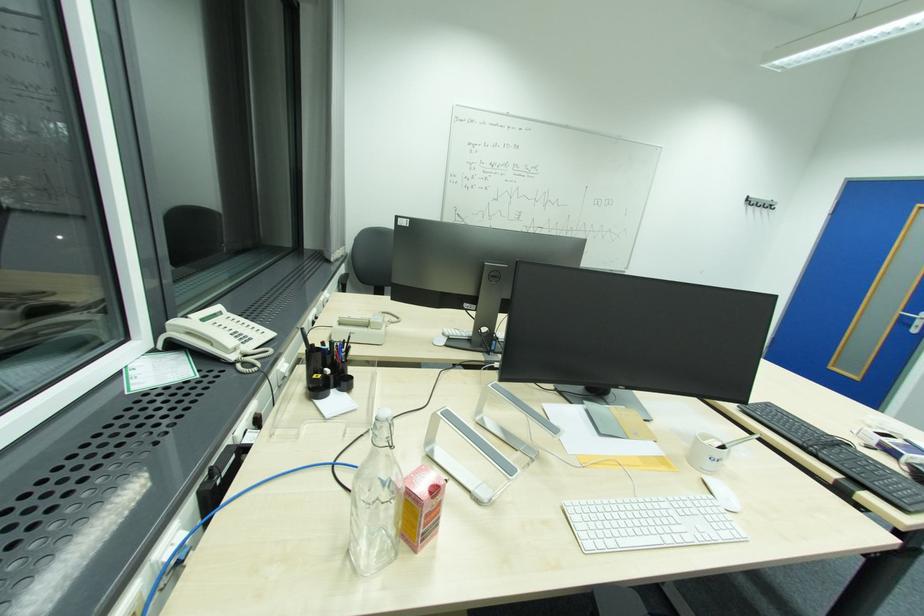
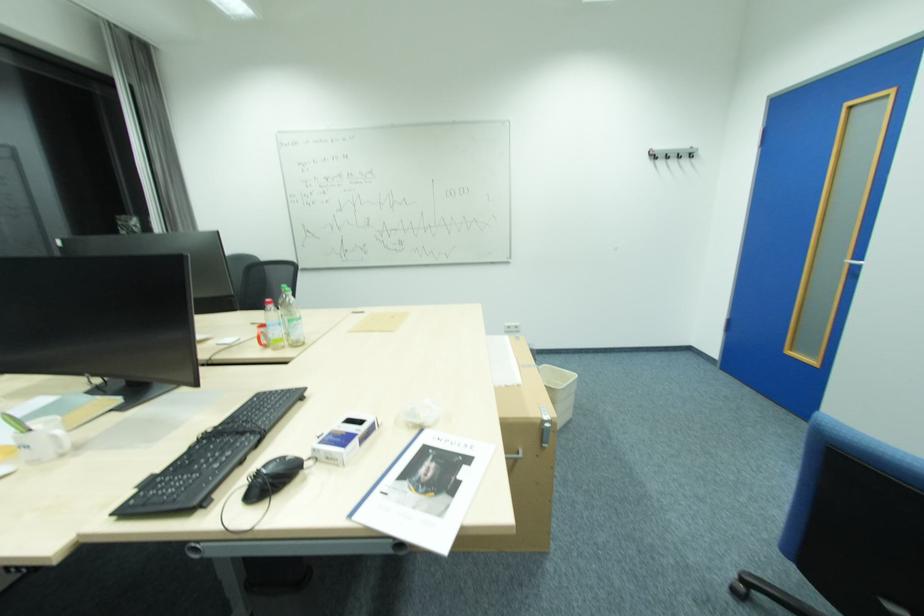
Question: Which direction would the cameraman need to move to produce the second image? Reply with the corresponding letter.

Choices:
 (A) Left
 (B) Right
 (C) Forward
 (D) Backward

Answer: (B)